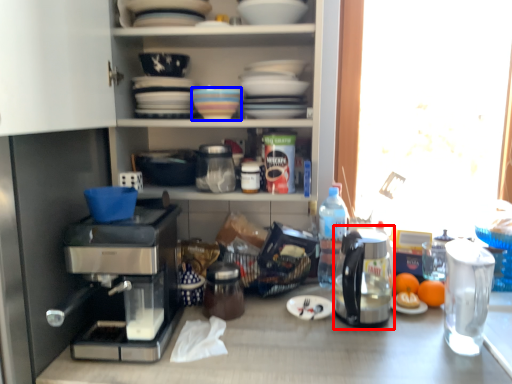
Question: Which of the following is the closest to the observer, coffeepot (highlighted by a red box) or tableware (highlighted by a blue box)?

Choices:
 (A) coffeepot
 (B) tableware

Answer: (A)